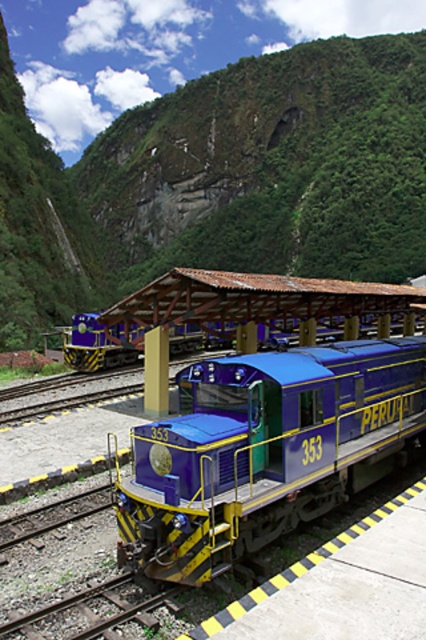
Question: Is metallic blue train at center positioned before matte blue train at center?

Choices:
 (A) no
 (B) yes

Answer: (B)

Question: Which point is closer to the camera?

Choices:
 (A) metallic blue train at center
 (B) matte blue train at center

Answer: (A)

Question: Does metallic blue train at center have a lesser width compared to matte blue train at center?

Choices:
 (A) no
 (B) yes

Answer: (B)

Question: Is metallic blue train at center wider than matte blue train at center?

Choices:
 (A) yes
 (B) no

Answer: (B)

Question: Among these points, which one is farthest from the camera?

Choices:
 (A) (397, 330)
 (B) (181, 445)

Answer: (A)